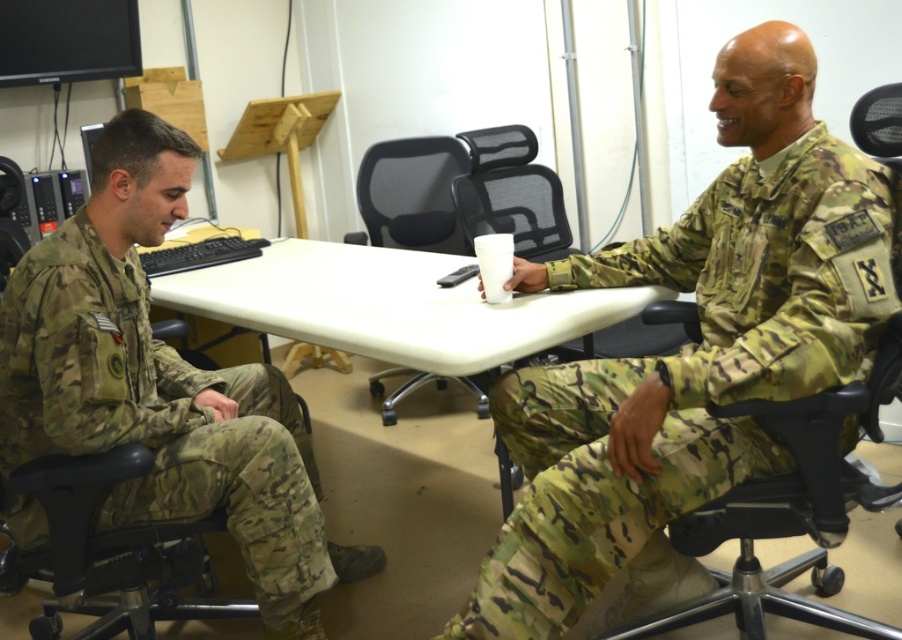
Question: Is camo fabric uniform at right below white plastic table at center?

Choices:
 (A) yes
 (B) no

Answer: (A)

Question: Which point is closer to the camera taking this photo?

Choices:
 (A) (518, 483)
 (B) (520, 564)
 (C) (431, 180)
 (D) (545, 307)

Answer: (B)

Question: From the image, what is the correct spatial relationship of white plastic table at center in relation to black mesh chair at center?

Choices:
 (A) below
 (B) above

Answer: (A)

Question: Is camo fabric uniform at right smaller than camouflage uniform at left?

Choices:
 (A) no
 (B) yes

Answer: (B)

Question: Which point is farther to the camera?

Choices:
 (A) pyautogui.click(x=749, y=252)
 (B) pyautogui.click(x=392, y=394)
 (C) pyautogui.click(x=49, y=364)

Answer: (B)

Question: Which point is farther to the camera?

Choices:
 (A) camo fabric uniform at right
 (B) black mesh chair at center
 (C) camouflage uniform at left
 (D) white plastic table at center

Answer: (B)